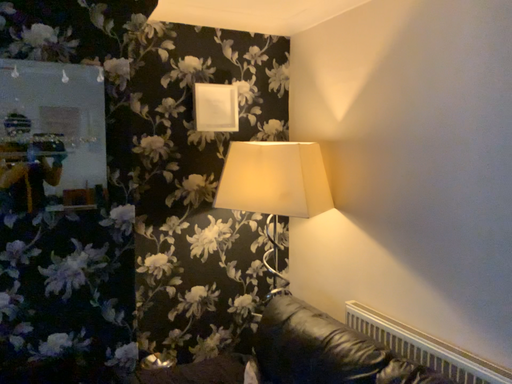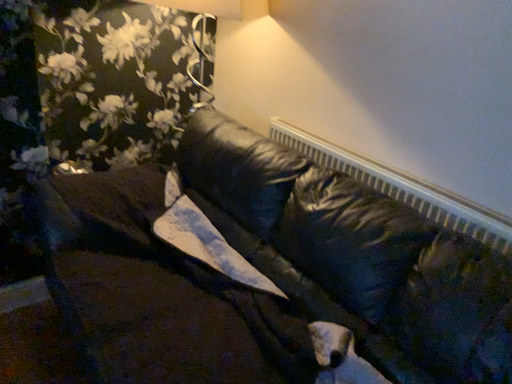
Question: How did the camera likely rotate when shooting the video?

Choices:
 (A) rotated upward
 (B) rotated downward

Answer: (B)